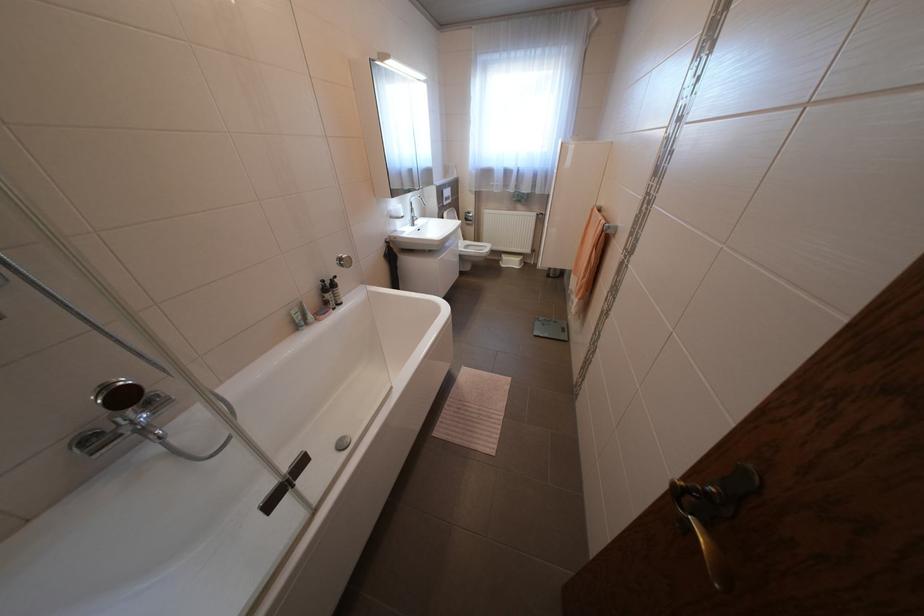
Find where to pull the faucet diverter knob. Please return your answer as a coordinate pair (x, y).

(148, 429)